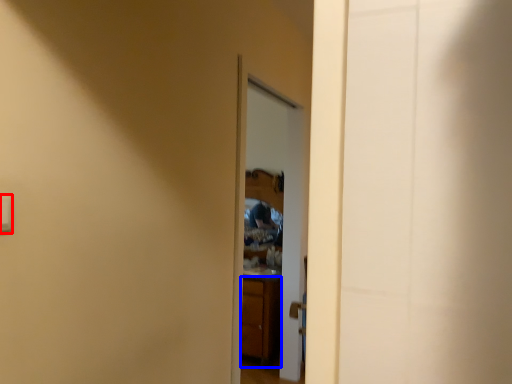
Question: Which of the following is the farthest to the observer, light switch (highlighted by a red box) or cabinetry (highlighted by a blue box)?

Choices:
 (A) light switch
 (B) cabinetry

Answer: (B)